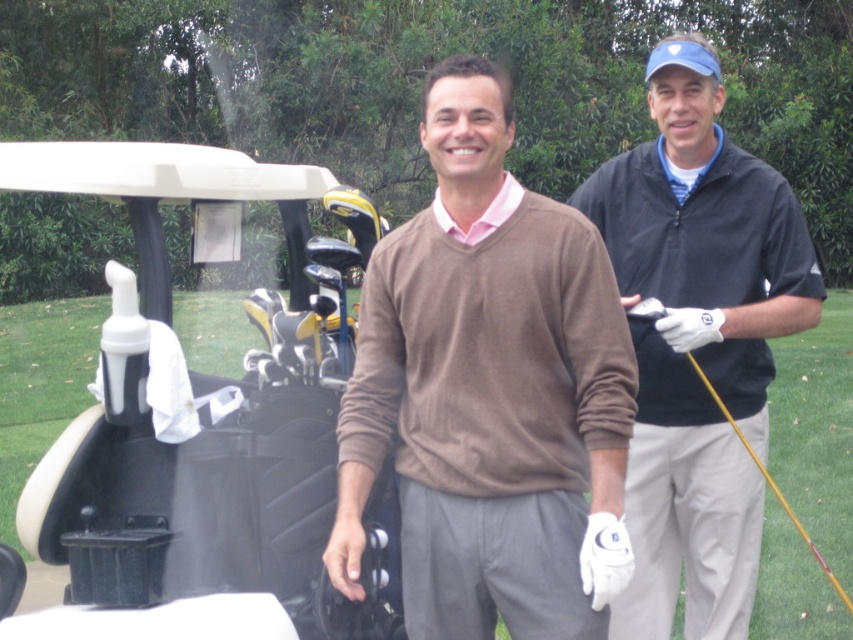
Question: Can you confirm if brown sweater at center is wider than yellow wood at right?

Choices:
 (A) no
 (B) yes

Answer: (A)

Question: Which of the following is the closest to the observer?

Choices:
 (A) yellow wood at right
 (B) brown sweater at center

Answer: (B)

Question: Does brown sweater at center appear on the left side of yellow wood at right?

Choices:
 (A) no
 (B) yes

Answer: (B)

Question: Can you confirm if white matte golf cart at left is thinner than dark blue zip-up jacket at upper right?

Choices:
 (A) yes
 (B) no

Answer: (B)

Question: Which object appears closest to the camera in this image?

Choices:
 (A) dark blue zip-up jacket at upper right
 (B) brown sweater at center
 (C) yellow wood at right
 (D) white matte golf cart at left

Answer: (B)

Question: Which point is farther to the camera?

Choices:
 (A) (849, 605)
 (B) (177, 554)
 (C) (666, 461)

Answer: (C)